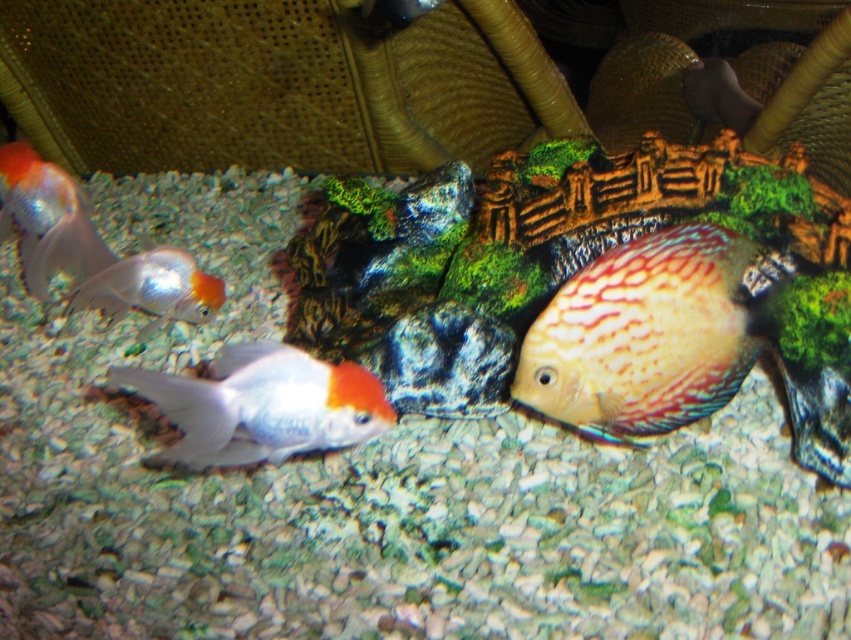
You are an underwater photographer aiming to capture a clear shot of the discus fish. You notice two points in the aquarium marked as point 1 at coordinates point (78, 192) and point 2 at coordinates point (164, 285). Which point is closer to your camera lens to ensure the discus fish is in focus?

Point 1 at coordinates point (78, 192) is closer to the viewer, so positioning the camera lens near this point would ensure the discus fish is in focus.

You are a robotic fish cleaner in the aquarium. Your mission is to navigate to a specific point marked by coordinates. The point is located at (647, 333). Which object in the aquarium should you avoid to reach that point?

The point at (647, 333) is on the multicolored textured discus at center, so you should avoid the discus to reach that point.